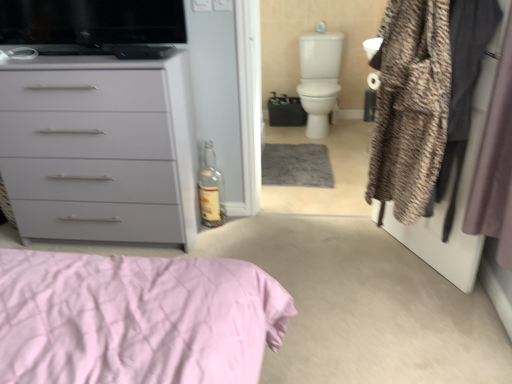
At what (x,y) coordinates should I click in order to perform the action: click on vacant area in front of fuzzy fabric coat at right. Please return your answer as a coordinate pair (x, y). Image resolution: width=512 pixels, height=384 pixels. Looking at the image, I should click on (418, 309).